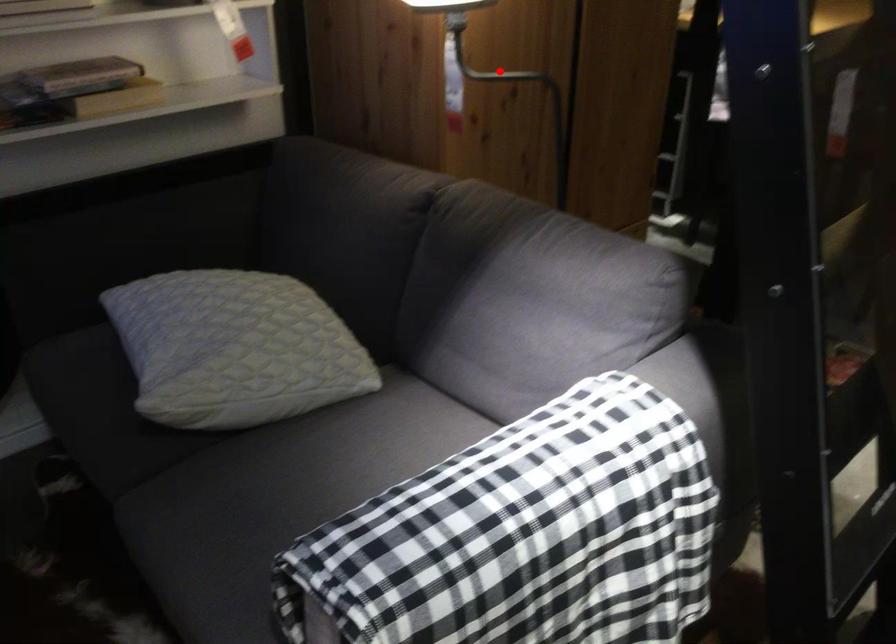
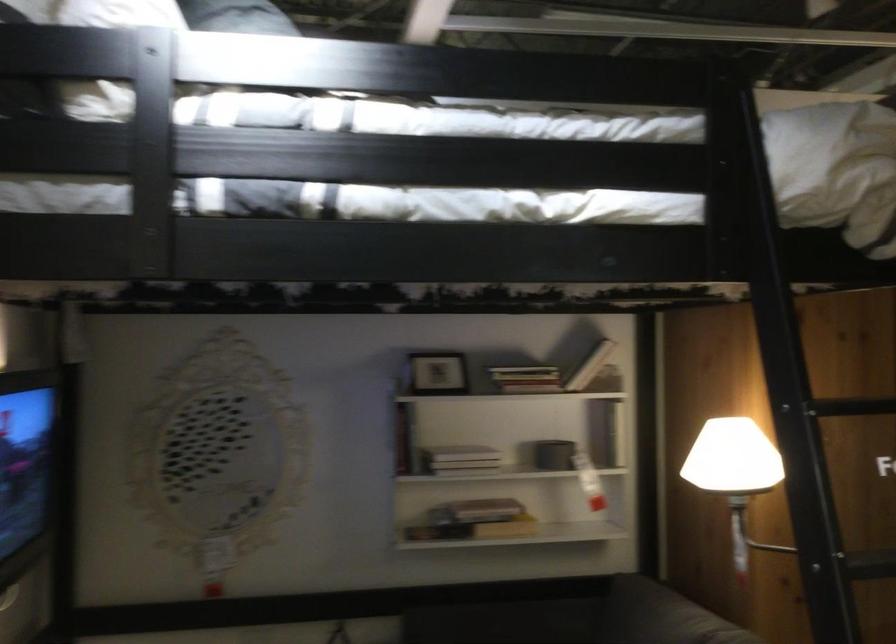
Question: I am providing you with two images of the same scene from different viewpoints. A red point is marked on the first image. Is the red point's position out of view in image 2?

Choices:
 (A) Yes
 (B) No

Answer: (A)